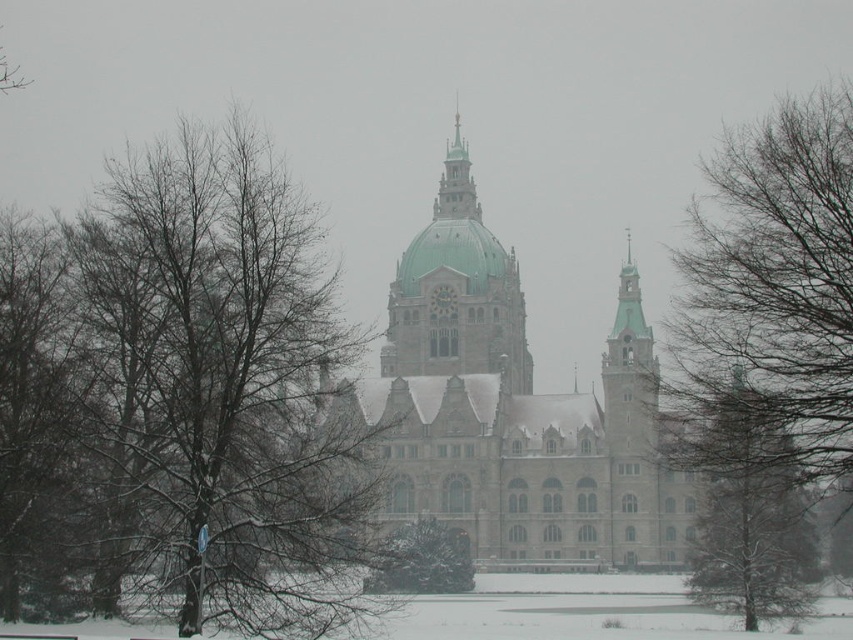
Can you confirm if bare branches at left is taller than green textured tree at center?

Yes, bare branches at left is taller than green textured tree at center.

Which is above, bare branches at left or green textured tree at center?

bare branches at left

The height and width of the screenshot is (640, 853). Identify the location of bare branches at left. (200, 401).

The width and height of the screenshot is (853, 640). Find the location of `bare branches at left`. bare branches at left is located at coordinates (200, 401).

Who is shorter, bare branches at left or polished copper spire at center?

polished copper spire at center

Is bare branches at left positioned at the back of polished copper spire at center?

No, it is in front of polished copper spire at center.

At what (x,y) coordinates should I click in order to perform the action: click on bare branches at left. Please return your answer as a coordinate pair (x, y). This screenshot has height=640, width=853. Looking at the image, I should click on (200, 401).

Based on the photo, can you confirm if green glazed dome at center is bigger than green textured tree at center?

Indeed, green glazed dome at center has a larger size compared to green textured tree at center.

Based on the photo, can you confirm if green glazed dome at center is positioned to the left of green textured tree at center?

No, green glazed dome at center is not to the left of green textured tree at center.

Is point (482, 353) positioned in front of point (386, 557)?

No, (482, 353) is behind (386, 557).

Locate an element on the screen. This screenshot has height=640, width=853. green glazed dome at center is located at coordinates (456, 291).